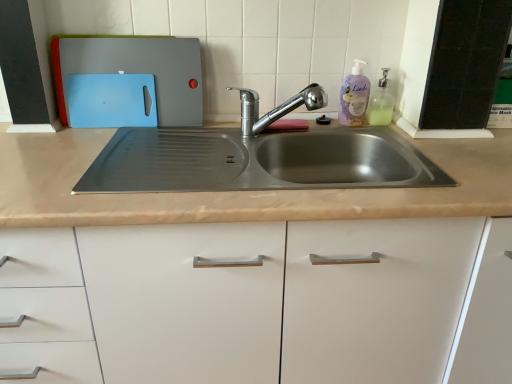
Question: From the image's perspective, does chrome metallic faucet at center appear higher than matte plastic cutting boards at upper left?

Choices:
 (A) no
 (B) yes

Answer: (A)

Question: Is chrome metallic faucet at center far away from matte plastic cutting boards at upper left?

Choices:
 (A) yes
 (B) no

Answer: (B)

Question: Does chrome metallic faucet at center have a larger size compared to matte plastic cutting boards at upper left?

Choices:
 (A) no
 (B) yes

Answer: (A)

Question: Is chrome metallic faucet at center smaller than matte plastic cutting boards at upper left?

Choices:
 (A) no
 (B) yes

Answer: (B)

Question: Can you confirm if chrome metallic faucet at center is positioned to the left of matte plastic cutting boards at upper left?

Choices:
 (A) no
 (B) yes

Answer: (A)

Question: In terms of width, does chrome metallic faucet at center look wider or thinner when compared to translucent plastic soap dispenser at upper right?

Choices:
 (A) thin
 (B) wide

Answer: (B)

Question: Does point (253, 94) appear closer or farther from the camera than point (387, 104)?

Choices:
 (A) farther
 (B) closer

Answer: (B)

Question: Visually, is chrome metallic faucet at center positioned to the left or to the right of translucent plastic soap dispenser at upper right?

Choices:
 (A) right
 (B) left

Answer: (B)

Question: Considering the positions of chrome metallic faucet at center and translucent plastic soap dispenser at upper right in the image, is chrome metallic faucet at center taller or shorter than translucent plastic soap dispenser at upper right?

Choices:
 (A) short
 (B) tall

Answer: (A)

Question: Considering the positions of chrome metallic faucet at center and matte plastic cutting boards at upper left in the image, is chrome metallic faucet at center wider or thinner than matte plastic cutting boards at upper left?

Choices:
 (A) wide
 (B) thin

Answer: (A)

Question: Considering the positions of chrome metallic faucet at center and matte plastic cutting boards at upper left in the image, is chrome metallic faucet at center taller or shorter than matte plastic cutting boards at upper left?

Choices:
 (A) short
 (B) tall

Answer: (A)

Question: From the image's perspective, is chrome metallic faucet at center above or below matte plastic cutting boards at upper left?

Choices:
 (A) above
 (B) below

Answer: (B)

Question: Based on their positions, is chrome metallic faucet at center located to the left or right of matte plastic cutting boards at upper left?

Choices:
 (A) right
 (B) left

Answer: (A)

Question: Is translucent plastic soap dispenser at upper right wider or thinner than chrome metallic faucet at center?

Choices:
 (A) thin
 (B) wide

Answer: (A)

Question: In terms of size, does translucent plastic soap dispenser at upper right appear bigger or smaller than chrome metallic faucet at center?

Choices:
 (A) small
 (B) big

Answer: (A)